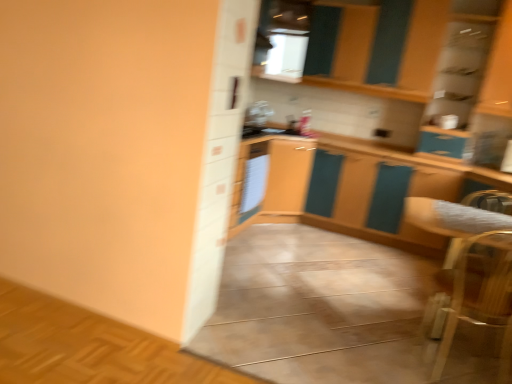
Question: From the image's perspective, is wooden armchair at lower right positioned above or below white glossy refrigerator at center?

Choices:
 (A) above
 (B) below

Answer: (B)

Question: In terms of width, does wooden armchair at lower right look wider or thinner when compared to white glossy refrigerator at center?

Choices:
 (A) wide
 (B) thin

Answer: (A)

Question: Looking at the image, does wooden armchair at lower right seem bigger or smaller compared to white glossy refrigerator at center?

Choices:
 (A) small
 (B) big

Answer: (B)

Question: Does point (253, 160) appear closer or farther from the camera than point (508, 324)?

Choices:
 (A) farther
 (B) closer

Answer: (A)

Question: Is white glossy refrigerator at center spatially inside wooden armchair at lower right, or outside of it?

Choices:
 (A) inside
 (B) outside

Answer: (B)

Question: From a real-world perspective, is white glossy refrigerator at center positioned above or below wooden armchair at lower right?

Choices:
 (A) below
 (B) above

Answer: (B)

Question: From the image's perspective, is white glossy refrigerator at center positioned above or below wooden armchair at lower right?

Choices:
 (A) above
 (B) below

Answer: (A)